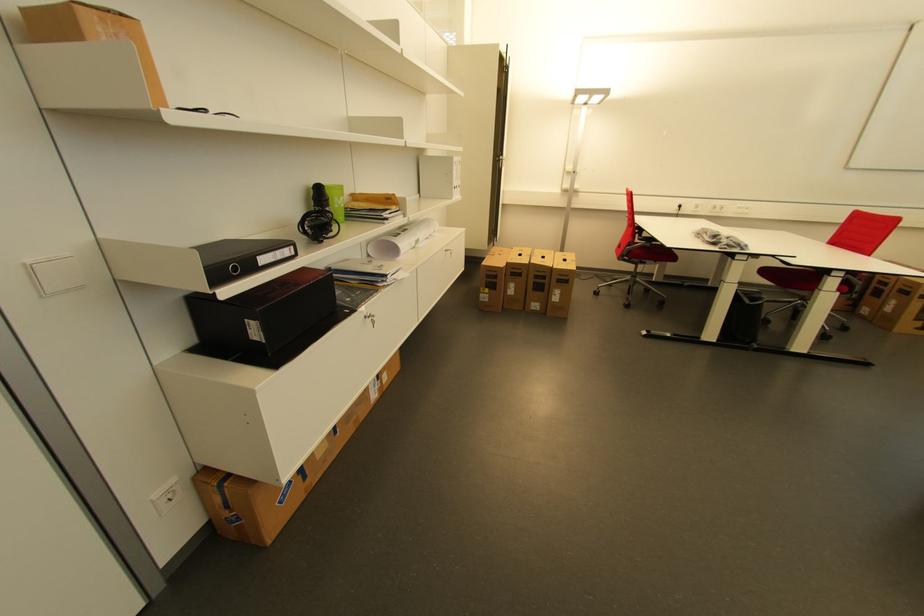
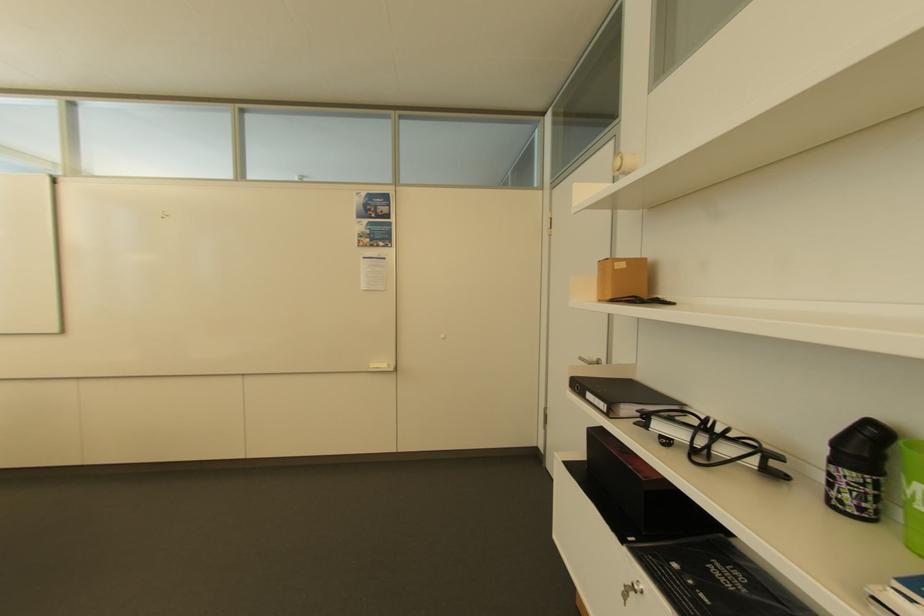
Where in the second image is the point corresponding to point (345, 204) from the first image?

(916, 493)